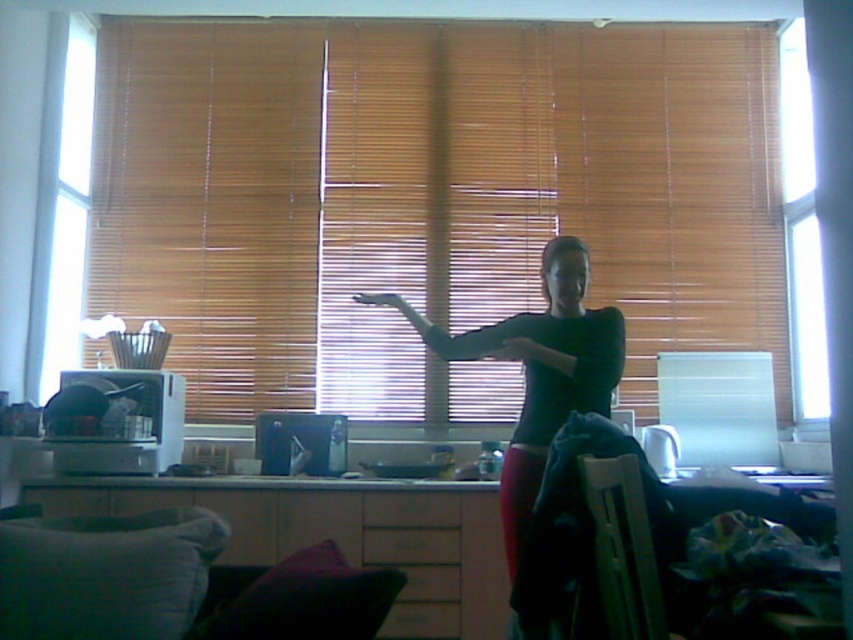
Question: Is brown wooden blinds at center closer to the viewer compared to matte black hand at center?

Choices:
 (A) yes
 (B) no

Answer: (B)

Question: Considering the real-world distances, which object is farthest from the transparent glass window at upper right?

Choices:
 (A) brown wooden blinds at center
 (B) matte plastic hand at center

Answer: (B)

Question: Among these points, which one is nearest to the camera?

Choices:
 (A) (811, 268)
 (B) (477, 372)

Answer: (B)

Question: Is black matte shirt at center above matte black hand at center?

Choices:
 (A) no
 (B) yes

Answer: (A)

Question: Which of the following is the closest to the observer?

Choices:
 (A) (366, 298)
 (B) (508, 355)
 (C) (347, 188)
 (D) (815, 276)

Answer: (B)

Question: Is black matte shirt at center smaller than matte black hand at center?

Choices:
 (A) no
 (B) yes

Answer: (A)